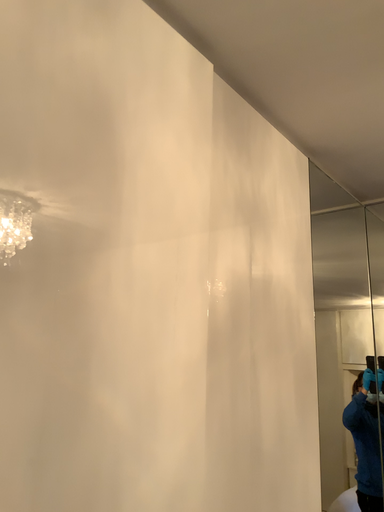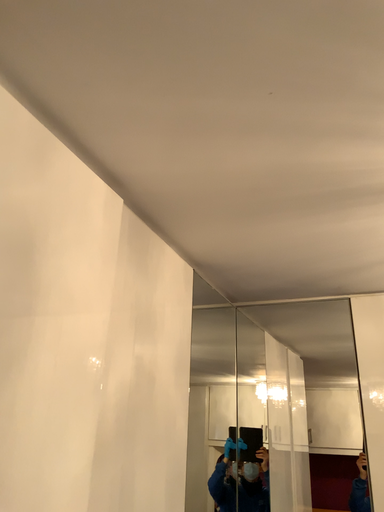
Question: How did the camera likely rotate when shooting the video?

Choices:
 (A) rotated right
 (B) rotated left

Answer: (A)